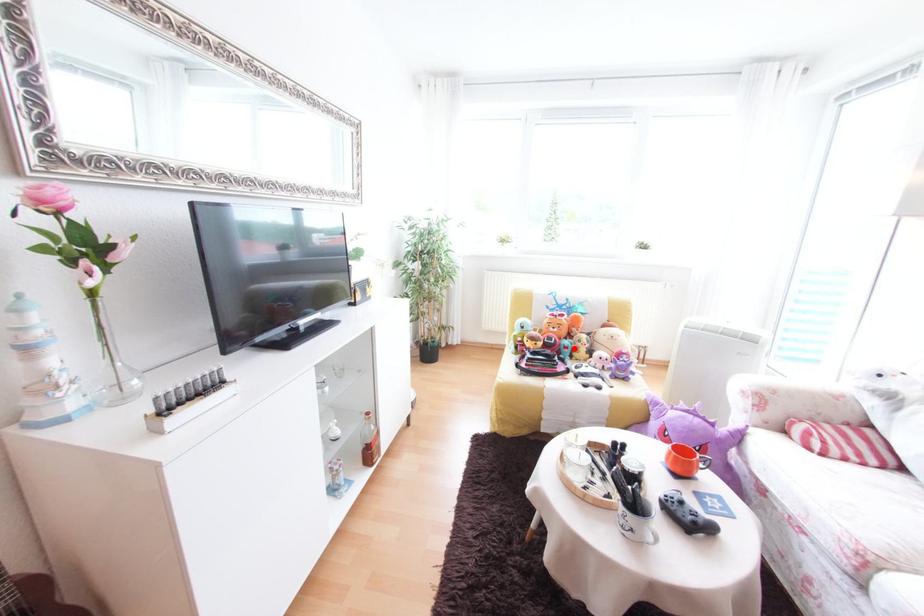
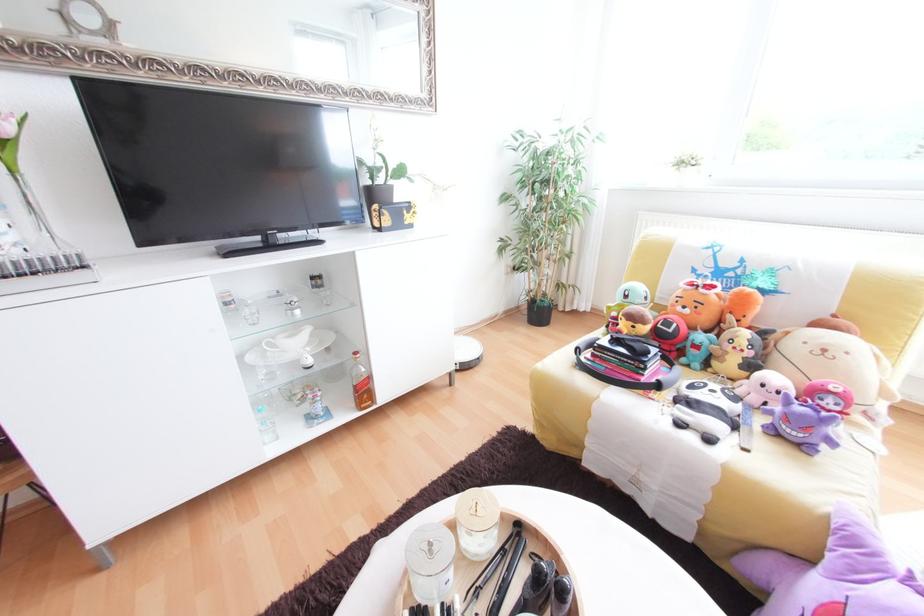
Locate, in the second image, the point that corresponds to the highlighted location in the first image.

(704, 347)